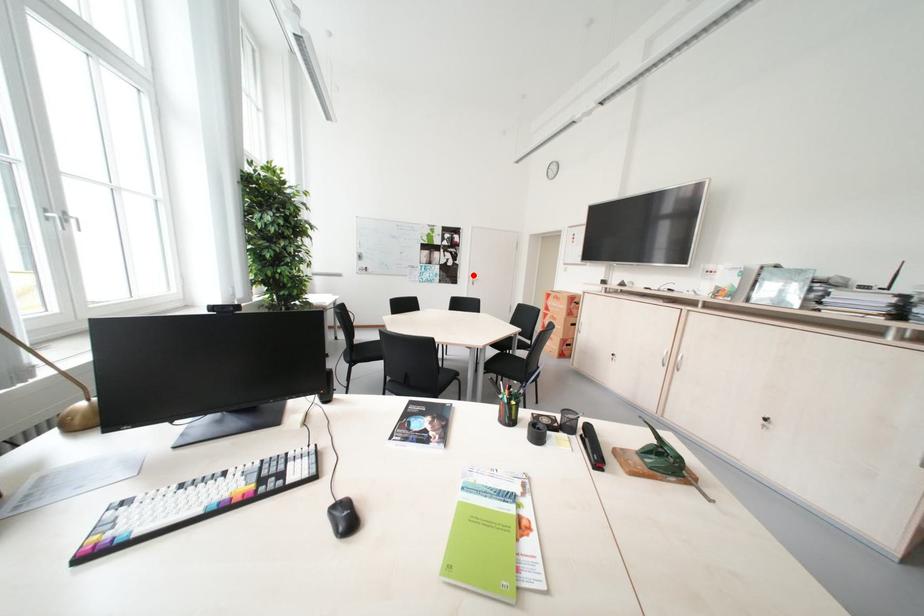
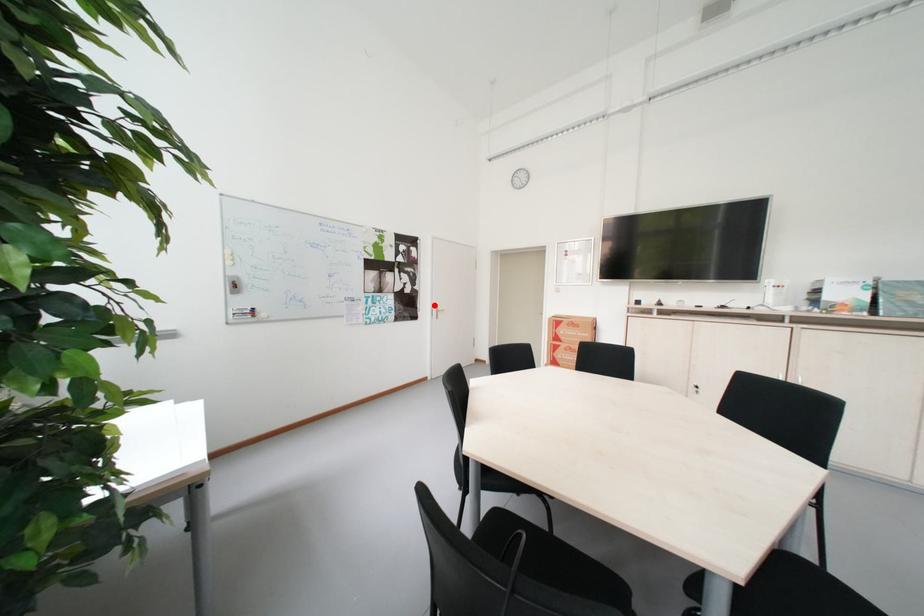
I am providing you with two images of the same scene from different viewpoints. A red point is marked on the first image and another point is marked on the second image. Are the points marked in image1 and image2 representing the same 3D position?

Yes